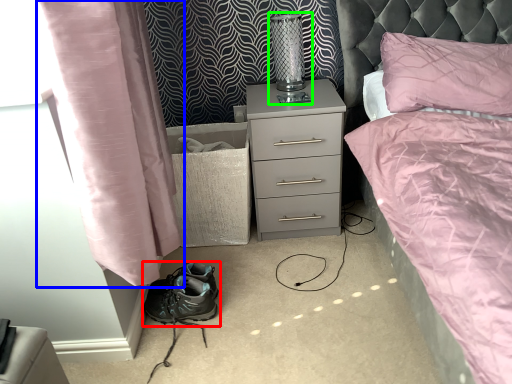
Question: Considering the real-world distances, which object is closest to footwear (highlighted by a red box)? curtain (highlighted by a blue box) or bedside lamp (highlighted by a green box).

Choices:
 (A) curtain
 (B) bedside lamp

Answer: (A)